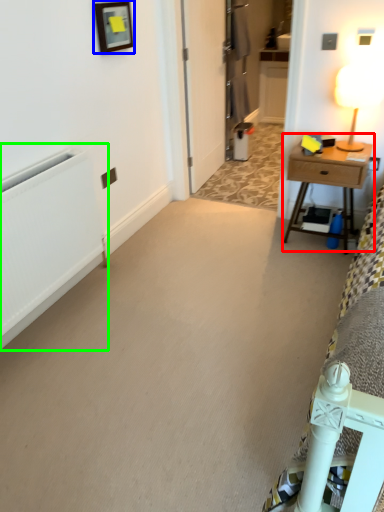
Question: Estimate the real-world distances between objects in this image. Which object is closer to nightstand (highlighted by a red box), picture frame (highlighted by a blue box) or radiator (highlighted by a green box)?

Choices:
 (A) picture frame
 (B) radiator

Answer: (A)